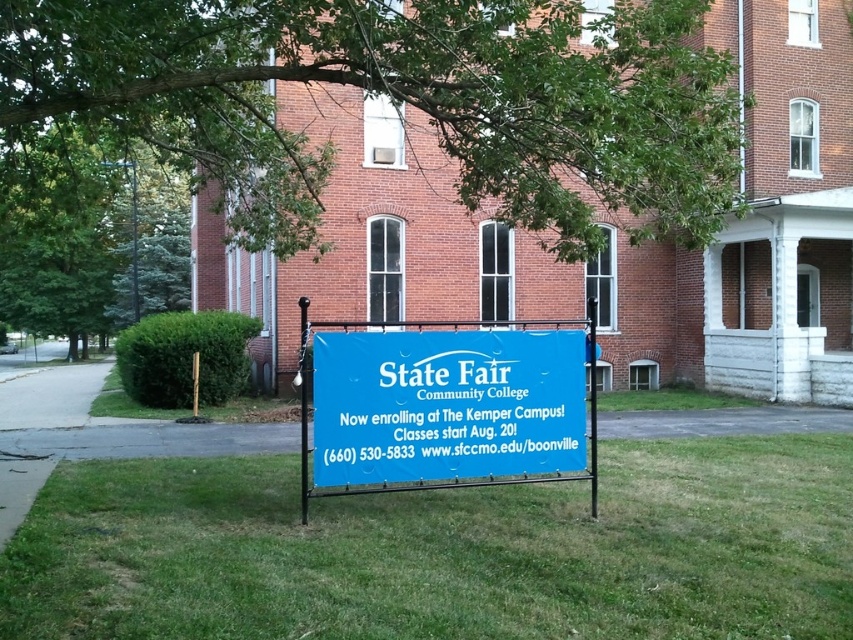
Question: Can you confirm if green grass at center is thinner than blue fabric sign at center?

Choices:
 (A) yes
 (B) no

Answer: (B)

Question: Which of the following is the closest to the observer?

Choices:
 (A) blue fabric sign at center
 (B) green grass at center

Answer: (B)

Question: Is green grass at center bigger than blue fabric sign at center?

Choices:
 (A) no
 (B) yes

Answer: (A)

Question: Is green grass at center bigger than blue fabric sign at center?

Choices:
 (A) yes
 (B) no

Answer: (B)

Question: Which object appears farthest from the camera in this image?

Choices:
 (A) green grass at center
 (B) blue fabric sign at center

Answer: (B)

Question: Which point is farther to the camera?

Choices:
 (A) blue fabric sign at center
 (B) green grass at center

Answer: (A)